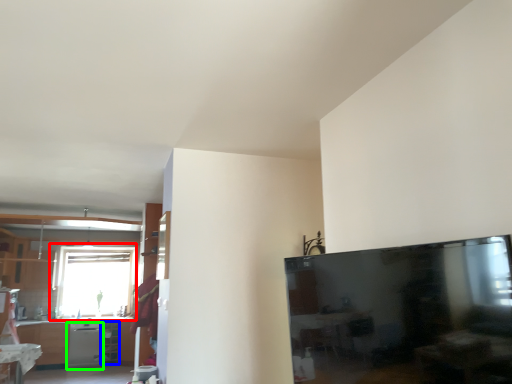
Question: Which object is positioned farthest from window (highlighted by a red box)? Select from shelf (highlighted by a blue box) and dish washer (highlighted by a green box).

Choices:
 (A) shelf
 (B) dish washer

Answer: (A)